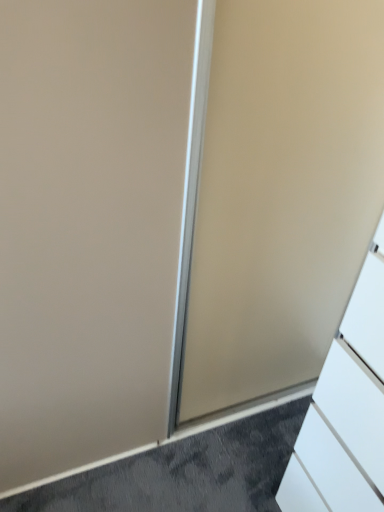
The image size is (384, 512). What do you see at coordinates (351, 401) in the screenshot?
I see `white glossy cabinet at right` at bounding box center [351, 401].

This screenshot has width=384, height=512. I want to click on white glossy cabinet at right, so click(351, 401).

This screenshot has width=384, height=512. Find the location of `white glossy cabinet at right`. white glossy cabinet at right is located at coordinates (351, 401).